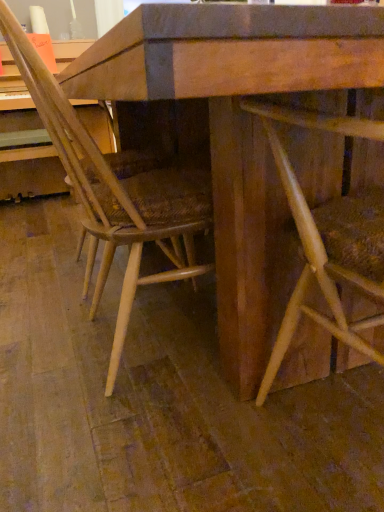
You are a GUI agent. You are given a task and a screenshot of the screen. Output one action in this format:
    pyautogui.click(x=<x>, y=<y>)
    Task: Click on the natural wood chair at center, which is the second chair from left to right
    
    Given the screenshot: What is the action you would take?
    pyautogui.click(x=325, y=240)

This screenshot has height=512, width=384. What do you see at coordinates (325, 240) in the screenshot?
I see `natural wood chair at center, which is the second chair from left to right` at bounding box center [325, 240].

Describe the element at coordinates (115, 194) in the screenshot. Image resolution: width=384 pixels, height=512 pixels. I see `natural wood chair at center, the first chair in the left-to-right sequence` at that location.

Locate an element on the screen. The height and width of the screenshot is (512, 384). natural wood chair at center, the first chair in the left-to-right sequence is located at coordinates (115, 194).

In order to click on natural wood chair at center, which is the second chair from left to right in this screenshot , I will do `click(325, 240)`.

Which is more to the left, natural wood chair at center, placed as the 1th chair when sorted from right to left, or natural wood chair at center, the first chair in the left-to-right sequence?

From the viewer's perspective, natural wood chair at center, the first chair in the left-to-right sequence, appears more on the left side.

Is natural wood chair at center, which is the second chair from left to right, behind natural wood chair at center, the first chair in the left-to-right sequence?

No, the depth of natural wood chair at center, which is the second chair from left to right, is less than that of natural wood chair at center, the first chair in the left-to-right sequence.

Does point (353, 119) come closer to viewer compared to point (85, 148)?

Yes.

From the image's perspective, is natural wood chair at center, which is the second chair from left to right, under natural wood chair at center, which is counted as the second chair, starting from the right?

Indeed, from the image's perspective, natural wood chair at center, which is the second chair from left to right, is shown beneath natural wood chair at center, which is counted as the second chair, starting from the right.

From a real-world perspective, relative to natural wood chair at center, the first chair in the left-to-right sequence, is natural wood chair at center, which is the second chair from left to right, vertically above or below?

In terms of real-world spatial position, natural wood chair at center, which is the second chair from left to right, is below natural wood chair at center, the first chair in the left-to-right sequence.

Can you confirm if natural wood chair at center, placed as the 1th chair when sorted from right to left, is wider than natural wood chair at center, which is counted as the second chair, starting from the right?

Incorrect, the width of natural wood chair at center, placed as the 1th chair when sorted from right to left, does not surpass that of natural wood chair at center, which is counted as the second chair, starting from the right.

In terms of height, does natural wood chair at center, placed as the 1th chair when sorted from right to left, look taller or shorter compared to natural wood chair at center, the first chair in the left-to-right sequence?

Considering their sizes, natural wood chair at center, placed as the 1th chair when sorted from right to left, has less height than natural wood chair at center, the first chair in the left-to-right sequence.

Does natural wood chair at center, which is the second chair from left to right, have a smaller size compared to natural wood chair at center, the first chair in the left-to-right sequence?

Yes, natural wood chair at center, which is the second chair from left to right, is smaller than natural wood chair at center, the first chair in the left-to-right sequence.

Is natural wood chair at center, the first chair in the left-to-right sequence, surrounded by natural wood chair at center, which is the second chair from left to right?

Actually, natural wood chair at center, the first chair in the left-to-right sequence, is outside natural wood chair at center, which is the second chair from left to right.

Does natural wood chair at center, which is the second chair from left to right, touch natural wood chair at center, which is counted as the second chair, starting from the right?

No, natural wood chair at center, which is the second chair from left to right, is not beside natural wood chair at center, which is counted as the second chair, starting from the right.

Is natural wood chair at center, which is the second chair from left to right, positioned with its back to natural wood chair at center, the first chair in the left-to-right sequence?

natural wood chair at center, which is the second chair from left to right, does not have its back to natural wood chair at center, the first chair in the left-to-right sequence.

How far apart are natural wood chair at center, placed as the 1th chair when sorted from right to left, and natural wood chair at center, which is counted as the second chair, starting from the right?

natural wood chair at center, placed as the 1th chair when sorted from right to left, and natural wood chair at center, which is counted as the second chair, starting from the right, are 43.14 centimeters apart.

Identify the location of chair that is under the natural wood chair at center, the first chair in the left-to-right sequence (from a real-world perspective). (325, 240).

Which is more to the left, natural wood chair at center, which is counted as the second chair, starting from the right, or natural wood chair at center, placed as the 1th chair when sorted from right to left?

From the viewer's perspective, natural wood chair at center, which is counted as the second chair, starting from the right, appears more on the left side.

Who is more distant, natural wood chair at center, the first chair in the left-to-right sequence, or natural wood chair at center, which is the second chair from left to right?

natural wood chair at center, the first chair in the left-to-right sequence, is behind.

Does point (113, 377) lie in front of point (287, 312)?

No, it is not.

From the image's perspective, is natural wood chair at center, the first chair in the left-to-right sequence, above or below natural wood chair at center, which is the second chair from left to right?

natural wood chair at center, the first chair in the left-to-right sequence, is above natural wood chair at center, which is the second chair from left to right.

From a real-world perspective, which is physically above, natural wood chair at center, the first chair in the left-to-right sequence, or natural wood chair at center, which is the second chair from left to right?

natural wood chair at center, the first chair in the left-to-right sequence, is physically above.

Considering the sizes of objects natural wood chair at center, which is counted as the second chair, starting from the right, and natural wood chair at center, which is the second chair from left to right, in the image provided, who is thinner, natural wood chair at center, which is counted as the second chair, starting from the right, or natural wood chair at center, which is the second chair from left to right,?

natural wood chair at center, which is the second chair from left to right, is thinner.

Considering the relative sizes of natural wood chair at center, which is counted as the second chair, starting from the right, and natural wood chair at center, placed as the 1th chair when sorted from right to left, in the image provided, is natural wood chair at center, which is counted as the second chair, starting from the right, shorter than natural wood chair at center, placed as the 1th chair when sorted from right to left,?

No, natural wood chair at center, which is counted as the second chair, starting from the right, is not shorter than natural wood chair at center, placed as the 1th chair when sorted from right to left.

Is natural wood chair at center, which is counted as the second chair, starting from the right, smaller than natural wood chair at center, which is the second chair from left to right?

No, natural wood chair at center, which is counted as the second chair, starting from the right, is not smaller than natural wood chair at center, which is the second chair from left to right.

Is natural wood chair at center, the first chair in the left-to-right sequence, situated inside natural wood chair at center, which is the second chair from left to right, or outside?

natural wood chair at center, the first chair in the left-to-right sequence, exists outside the volume of natural wood chair at center, which is the second chair from left to right.

Are natural wood chair at center, the first chair in the left-to-right sequence, and natural wood chair at center, placed as the 1th chair when sorted from right to left, beside each other?

They are not placed beside each other.

Is natural wood chair at center, the first chair in the left-to-right sequence, facing away from natural wood chair at center, which is the second chair from left to right?

No, natural wood chair at center, the first chair in the left-to-right sequence, is not facing the opposite direction of natural wood chair at center, which is the second chair from left to right.

How distant is natural wood chair at center, the first chair in the left-to-right sequence, from natural wood chair at center, placed as the 1th chair when sorted from right to left?

natural wood chair at center, the first chair in the left-to-right sequence, and natural wood chair at center, placed as the 1th chair when sorted from right to left, are 16.99 inches apart from each other.

You are a GUI agent. You are given a task and a screenshot of the screen. Output one action in this format:
    pyautogui.click(x=<x>, y=<y>)
    Task: Click on the chair below the natural wood chair at center, the first chair in the left-to-right sequence (from the image's perspective)
    
    Given the screenshot: What is the action you would take?
    pyautogui.click(x=325, y=240)

At what (x,y) coordinates should I click in order to perform the action: click on chair above the natural wood chair at center, which is the second chair from left to right (from a real-world perspective). Please return your answer as a coordinate pair (x, y). This screenshot has height=512, width=384. Looking at the image, I should click on (115, 194).

In order to click on chair that appears below the natural wood chair at center, which is counted as the second chair, starting from the right (from a real-world perspective) in this screenshot , I will do [x=325, y=240].